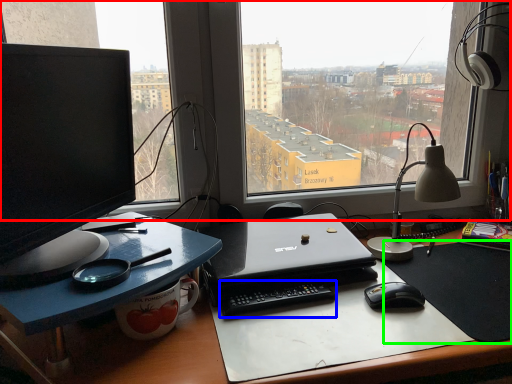
Question: Which object is positioned farthest from window (highlighted by a red box)? Select from laptop keyboard (highlighted by a blue box) and mousepad (highlighted by a green box).

Choices:
 (A) laptop keyboard
 (B) mousepad

Answer: (A)